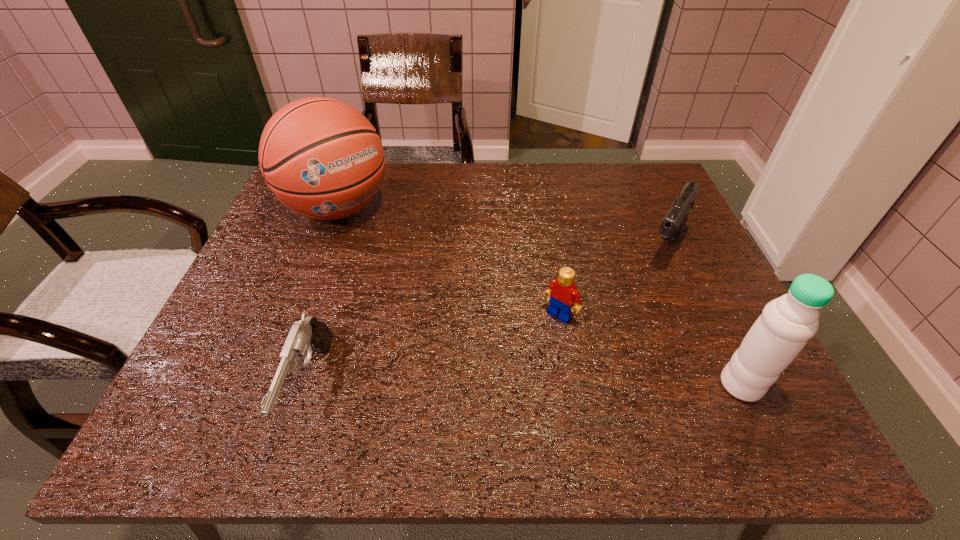
This screenshot has height=540, width=960. I want to click on vacant space on the desktop that is between the gun and the water bottle and is positioned at the barrel of the pistol, so click(583, 386).

You are a GUI agent. You are given a task and a screenshot of the screen. Output one action in this format:
    pyautogui.click(x=<x>, y=<y>)
    Task: Click on the vacant space on the desktop that is between the gun and the water bottle and is positioned on the front-facing side of the third farthest object
    The width and height of the screenshot is (960, 540).
    Given the screenshot: What is the action you would take?
    pyautogui.click(x=496, y=386)

The image size is (960, 540). Identify the location of vacant space on the desktop that is between the gun and the water bottle and is positioned on the logo side of the basketball. (511, 386).